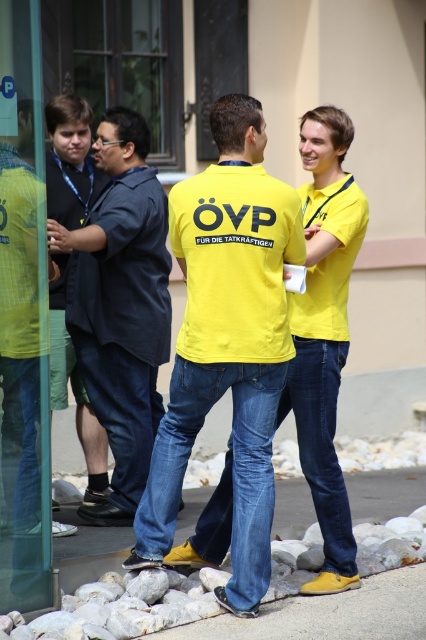
Which is above, yellow matte shirt at center or matte black jacket at left?

yellow matte shirt at center is above.

Is yellow matte shirt at center closer to the viewer compared to matte black jacket at left?

That is True.

Between point (227, 301) and point (71, 358), which one is positioned in front?

Point (227, 301) is more forward.

The width and height of the screenshot is (426, 640). What are the coordinates of `yellow matte shirt at center` in the screenshot? It's located at (227, 342).

Is transparent glass door at left further to the viewer compared to matte black jacket at left?

No, transparent glass door at left is in front of matte black jacket at left.

Can you confirm if transparent glass door at left is thinner than matte black jacket at left?

Correct, transparent glass door at left's width is less than matte black jacket at left's.

Between point (32, 467) and point (57, 97), which one is positioned behind?

The point (57, 97) is behind.

Identify the location of transparent glass door at left. (23, 317).

Does yellow matte shirt at center have a lesser width compared to dark blue shirt at left?

No.

Is yellow matte shirt at center closer to the viewer compared to dark blue shirt at left?

Yes.

Does point (245, 316) come farther from viewer compared to point (131, 138)?

No, (245, 316) is in front of (131, 138).

Where is `yellow matte shirt at center`? Image resolution: width=426 pixels, height=640 pixels. yellow matte shirt at center is located at coordinates (227, 342).